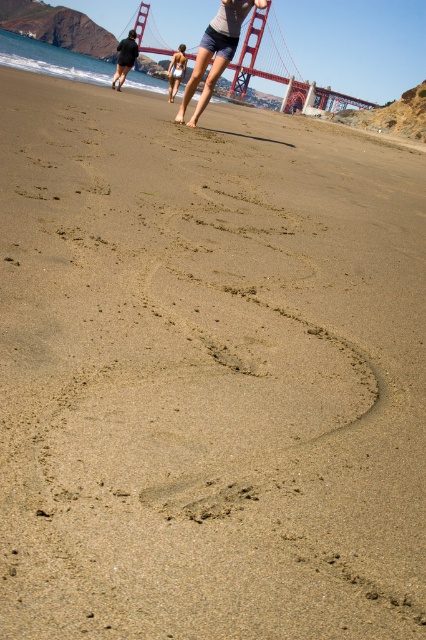
Find the location of `red painted steel golden gate bridge at upper center`. red painted steel golden gate bridge at upper center is located at coordinates (265, 58).

Which is in front, point (230, 64) or point (204, 68)?

Point (204, 68)

Where is `red painted steel golden gate bridge at upper center`? The height and width of the screenshot is (640, 426). red painted steel golden gate bridge at upper center is located at coordinates (265, 58).

Which is more to the left, dark blue hoodie at left or white bikini at center?

Positioned to the left is dark blue hoodie at left.

Does point (129, 38) come closer to viewer compared to point (183, 61)?

Yes, point (129, 38) is in front of point (183, 61).

Between point (129, 32) and point (169, 88), which one is positioned behind?

The point (129, 32) is behind.

Identify the location of dark blue hoodie at left. The image size is (426, 640). (124, 58).

Which of these two, red painted steel golden gate bridge at upper center or dark blue hoodie at left, stands taller?

red painted steel golden gate bridge at upper center is taller.

Does point (195, 58) lie in front of point (124, 60)?

No, (195, 58) is behind (124, 60).

Is point (137, 13) closer to camera compared to point (126, 52)?

No.

This screenshot has width=426, height=640. Find the location of `red painted steel golden gate bridge at upper center`. red painted steel golden gate bridge at upper center is located at coordinates (265, 58).